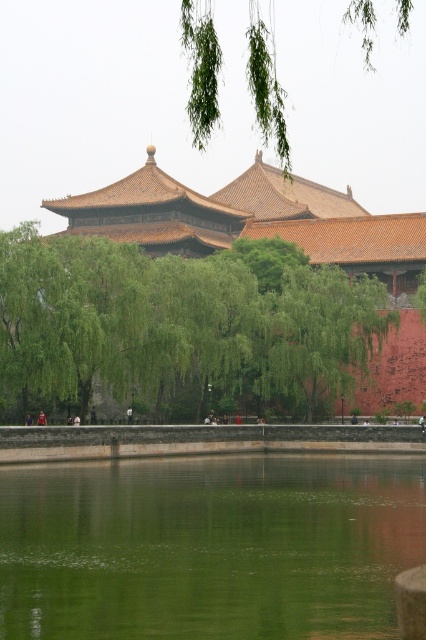
You are an architect visiting the Forbidden City and want to compare the sizes of the green leafy tree at center and the green leafy branches at upper center. Which one is larger?

The green leafy branches at upper center are larger than the green leafy tree at center.

From the picture: You are an architect designing a new garden and want to incorporate elements from the Forbidden City scene. You have a green leafy tree at center and a green reflective water at center. Which element has a smaller width in the image?

The green reflective water at center has a smaller width than the green leafy tree at center.